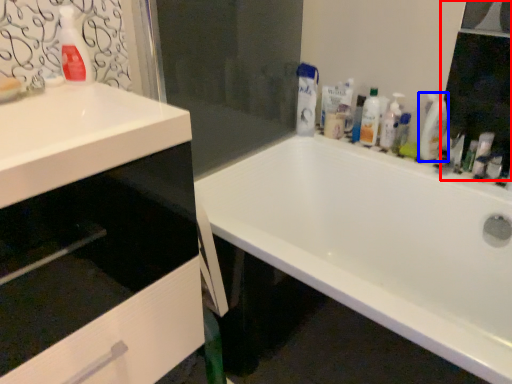
Question: Which of the following is the farthest to the observer, mirror (highlighted by a red box) or cleaning product (highlighted by a blue box)?

Choices:
 (A) mirror
 (B) cleaning product

Answer: (B)